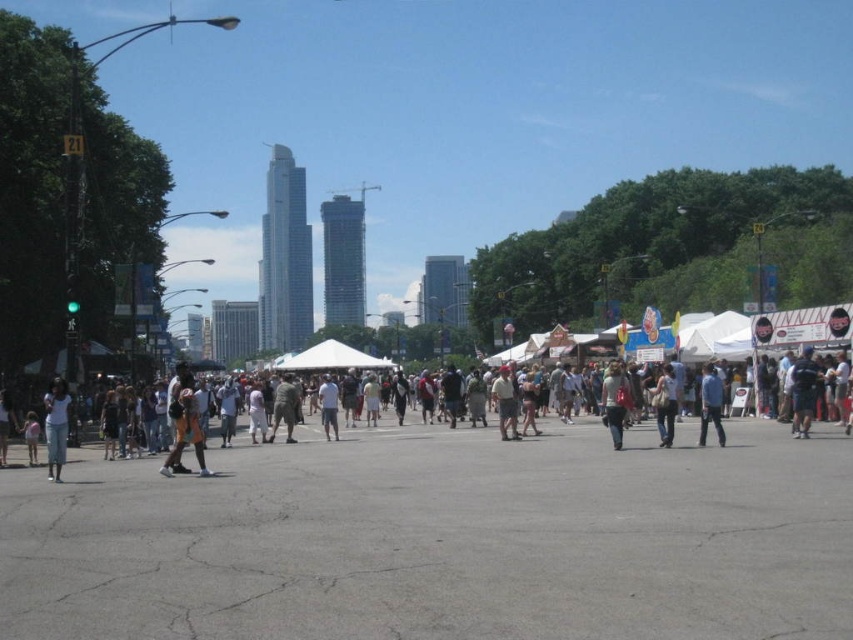
You are a photographer at the fair and want to capture both the light gray cotton shirt at center and the white cotton shirt at center in one frame. Which shirt should you focus on to ensure both are visible without zooming in?

You should focus on the white cotton shirt at center because it occupies more space than the light gray cotton shirt at center, making it easier to include both in the frame without zooming in.